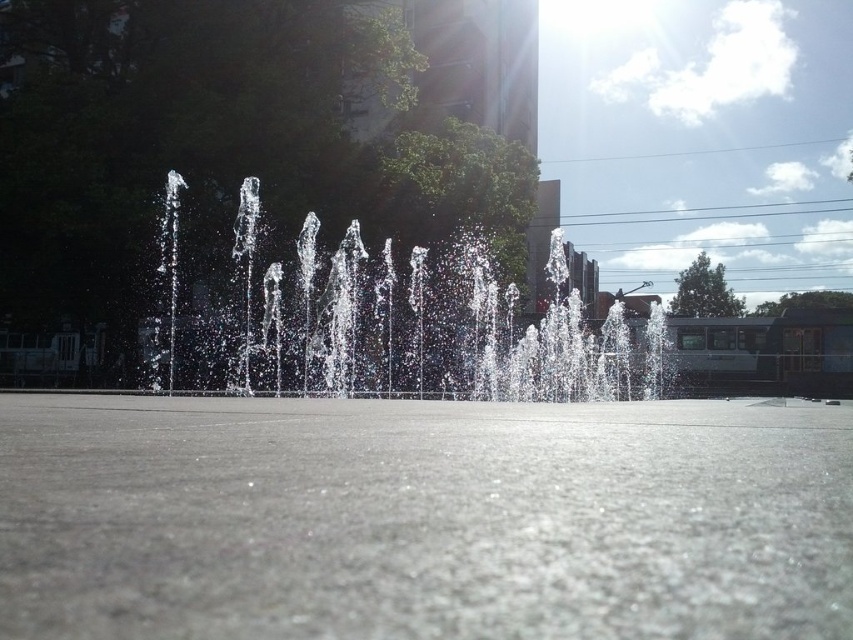
Question: Which object is farther from the camera taking this photo?

Choices:
 (A) clear water at center
 (B) transparent liquid water at center

Answer: (A)

Question: Does transparent liquid water at center have a greater width compared to clear water at center?

Choices:
 (A) no
 (B) yes

Answer: (A)

Question: Which of the following is the farthest from the observer?

Choices:
 (A) clear water at center
 (B) transparent liquid water at center

Answer: (A)

Question: Is the position of transparent liquid water at center more distant than that of clear water at center?

Choices:
 (A) no
 (B) yes

Answer: (A)

Question: Can you confirm if transparent liquid water at center is thinner than clear water at center?

Choices:
 (A) yes
 (B) no

Answer: (A)